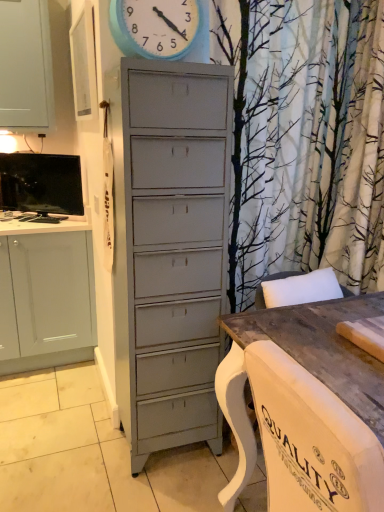
Question: Is point (329, 349) closer or farther from the camera than point (69, 204)?

Choices:
 (A) closer
 (B) farther

Answer: (A)

Question: In terms of size, does wooden table at lower right appear bigger or smaller than matte black tv at upper left?

Choices:
 (A) small
 (B) big

Answer: (B)

Question: Based on their relative distances, which object is nearer to the matte black tv at upper left?

Choices:
 (A) blue painted wood clock at upper center
 (B) wooden table at lower right

Answer: (A)

Question: Considering the real-world distances, which object is farthest from the wooden table at lower right?

Choices:
 (A) matte black tv at upper left
 (B) blue painted wood clock at upper center

Answer: (A)